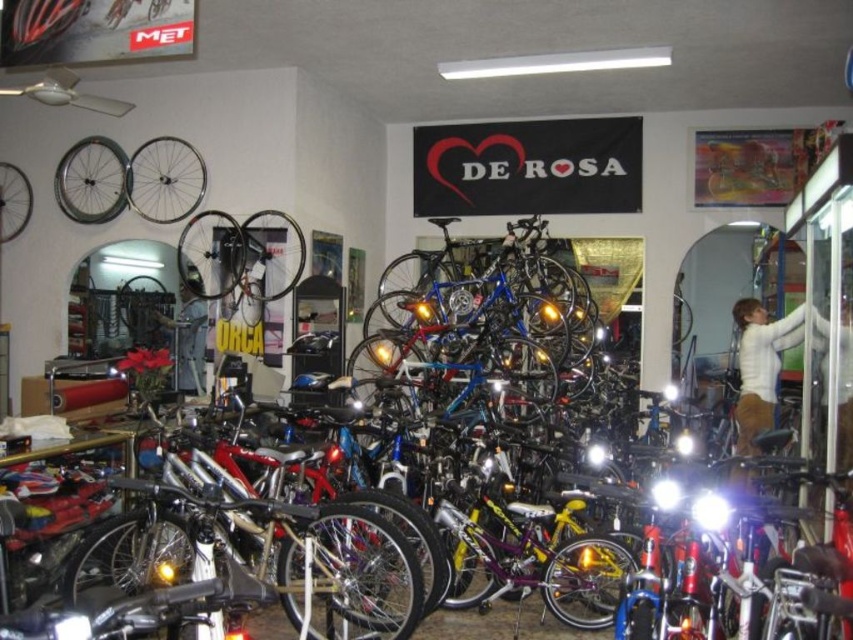
What do you see at coordinates (131, 179) in the screenshot?
I see `shiny silver wheel at upper left` at bounding box center [131, 179].

Image resolution: width=853 pixels, height=640 pixels. In order to click on shiny silver wheel at upper left in this screenshot , I will do `click(131, 179)`.

At what (x,y) coordinates should I click in order to perform the action: click on shiny silver wheel at upper left. Please return your answer as a coordinate pair (x, y). Image resolution: width=853 pixels, height=640 pixels. Looking at the image, I should click on (131, 179).

Is shiny silver wheel at upper left wider than denim jacket at center?

Yes.

Image resolution: width=853 pixels, height=640 pixels. What do you see at coordinates (131, 179) in the screenshot?
I see `shiny silver wheel at upper left` at bounding box center [131, 179].

This screenshot has height=640, width=853. I want to click on shiny silver wheel at upper left, so click(131, 179).

Is white matte shirt at right shorter than denim jacket at center?

Incorrect, white matte shirt at right's height does not fall short of denim jacket at center's.

Is white matte shirt at right taller than denim jacket at center?

Yes.

Between point (848, 400) and point (207, 381), which one is positioned behind?

Point (207, 381)

Find the location of `white matte shirt at right`. white matte shirt at right is located at coordinates 759,365.